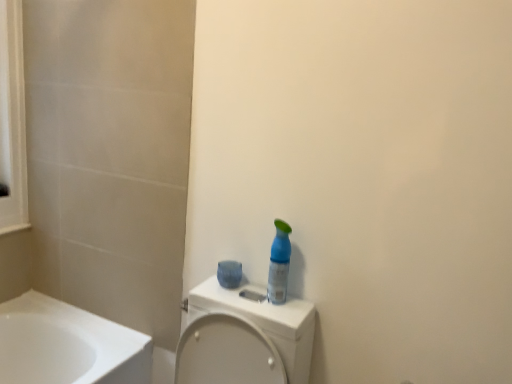
Where is `transparent plastic spray bottle at center`? This screenshot has height=384, width=512. transparent plastic spray bottle at center is located at coordinates (279, 264).

Measure the distance between transparent plastic spray bottle at center and camera.

transparent plastic spray bottle at center and camera are 1.21 meters apart.

In order to face transparent plastic spray bottle at center, should I rotate leftwards or rightwards?

To face it directly, rotate right by 3.461 degrees.

This screenshot has height=384, width=512. What do you see at coordinates (279, 264) in the screenshot? I see `transparent plastic spray bottle at center` at bounding box center [279, 264].

Locate an element on the screen. transparent plastic spray bottle at center is located at coordinates (279, 264).